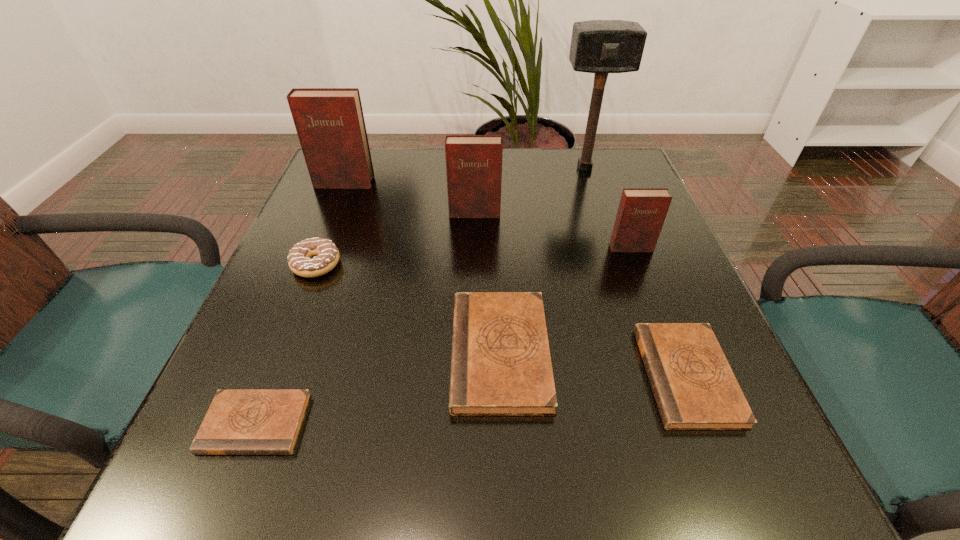
The height and width of the screenshot is (540, 960). Find the location of `the biggest brown diary`. the biggest brown diary is located at coordinates (501, 365).

The height and width of the screenshot is (540, 960). In order to click on the second brown diary from right to left in this screenshot , I will do `click(501, 365)`.

Image resolution: width=960 pixels, height=540 pixels. What are the coordinates of `the rightmost brown diary` in the screenshot? It's located at (694, 386).

Identify the location of the seventh tallest object. This screenshot has width=960, height=540. (694, 386).

Find the location of a particular element. The width and height of the screenshot is (960, 540). the smallest brown diary is located at coordinates (238, 422).

You are a GUI agent. You are given a task and a screenshot of the screen. Output one action in this format:
    pyautogui.click(x=<x>, y=<y>)
    Task: Click on the shortest diary
    This screenshot has height=540, width=960.
    Given the screenshot: What is the action you would take?
    238,422

This screenshot has width=960, height=540. What are the coordinates of `free location located on the front of the mallet` in the screenshot? It's located at (591, 187).

The image size is (960, 540). I want to click on free spot located on the front cover of the leftmost reddish-brown diary, so click(x=331, y=215).

Where is `blank space located 0.360m on the front cover of the second reddish-brown diary from right to left`? blank space located 0.360m on the front cover of the second reddish-brown diary from right to left is located at coordinates (472, 348).

Locate an element on the screen. This screenshot has height=540, width=960. free location located 0.130m on the front cover of the fourth nearest diary is located at coordinates point(650,298).